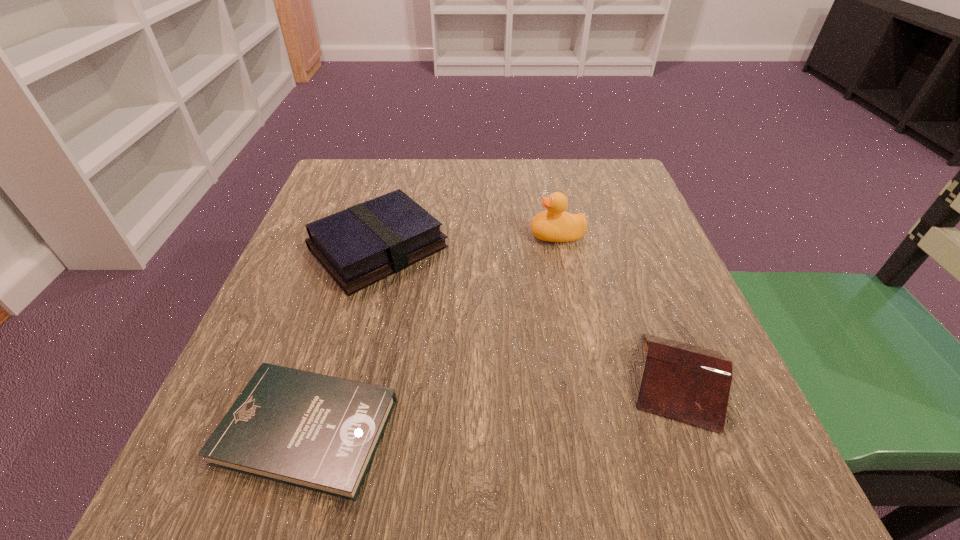
Image resolution: width=960 pixels, height=540 pixels. In the image, there is a desktop. Find the location of `blank space at the near edge`. blank space at the near edge is located at coordinates (602, 498).

Locate an element on the screen. vacant space at the left edge is located at coordinates (285, 359).

Locate an element on the screen. The image size is (960, 540). vacant space at the right edge is located at coordinates (647, 234).

Identify the location of vacant space at the far left corner of the desktop. The image size is (960, 540). (341, 195).

In the image, there is a desktop. Find the location of `vacant space at the far right corner`. vacant space at the far right corner is located at coordinates (629, 188).

Locate an element on the screen. free spot between the tallest object and the shortest object is located at coordinates (432, 333).

Find the location of `free space between the shortest book and the tallest object`. free space between the shortest book and the tallest object is located at coordinates pyautogui.click(x=432, y=333).

Where is `vacant area that lies between the second shortest object and the second tallest object`? Image resolution: width=960 pixels, height=540 pixels. vacant area that lies between the second shortest object and the second tallest object is located at coordinates (528, 314).

Where is `vacant region between the tallest object and the shortest book`? The image size is (960, 540). vacant region between the tallest object and the shortest book is located at coordinates (432, 333).

The width and height of the screenshot is (960, 540). I want to click on vacant area between the tallest object and the shortest object, so click(432, 333).